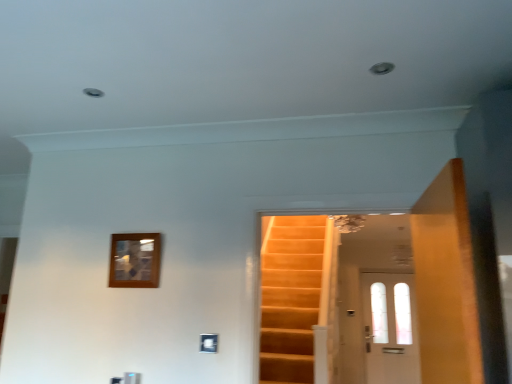
Question: Visually, is wooden picture frame at upper left positioned to the left or to the right of white glass door at center, which appears as the second door when viewed from the left?

Choices:
 (A) left
 (B) right

Answer: (A)

Question: Is point (112, 246) positioned closer to the camera than point (410, 299)?

Choices:
 (A) farther
 (B) closer

Answer: (B)

Question: Which object is the closest to the white glass door at center, which ranks as the 2th door in top-to-bottom order?

Choices:
 (A) wooden picture frame at upper left
 (B) wooden door at right, which is the 2th door from right to left

Answer: (B)

Question: Which of these objects is positioned closest to the wooden door at right, positioned as the 1th door in left-to-right order?

Choices:
 (A) wooden picture frame at upper left
 (B) white glass door at center, which appears as the second door when viewed from the left

Answer: (A)